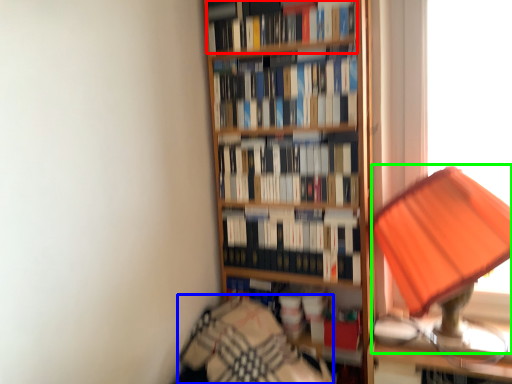
Question: Which is nearer to the book (highlighted by a red box)? bedding (highlighted by a blue box) or table lamp (highlighted by a green box).

Choices:
 (A) bedding
 (B) table lamp

Answer: (B)